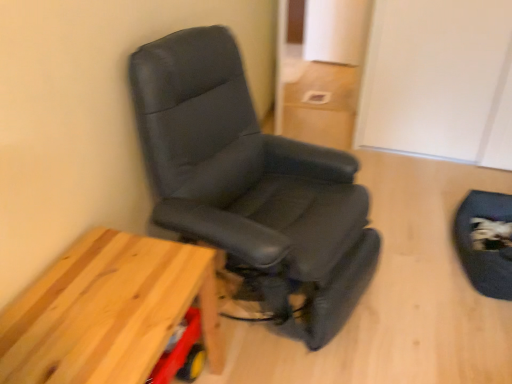
Question: Is black leather swivel chair at lower right surrounding wooden table at lower left?

Choices:
 (A) no
 (B) yes

Answer: (A)

Question: From the image's perspective, is black leather swivel chair at lower right under wooden table at lower left?

Choices:
 (A) yes
 (B) no

Answer: (B)

Question: Can you confirm if black leather swivel chair at lower right is positioned to the right of wooden table at lower left?

Choices:
 (A) yes
 (B) no

Answer: (A)

Question: Are black leather swivel chair at lower right and wooden table at lower left far apart?

Choices:
 (A) no
 (B) yes

Answer: (B)

Question: Considering the relative sizes of black leather swivel chair at lower right and wooden table at lower left in the image provided, is black leather swivel chair at lower right bigger than wooden table at lower left?

Choices:
 (A) no
 (B) yes

Answer: (A)

Question: From a real-world perspective, is black leather swivel chair at lower right physically below wooden table at lower left?

Choices:
 (A) no
 (B) yes

Answer: (B)

Question: Does wooden table at lower left touch black leather swivel chair at lower right?

Choices:
 (A) no
 (B) yes

Answer: (A)

Question: Can black leather swivel chair at lower right be found inside wooden table at lower left?

Choices:
 (A) yes
 (B) no

Answer: (B)

Question: From a real-world perspective, does wooden table at lower left sit lower than black leather swivel chair at lower right?

Choices:
 (A) yes
 (B) no

Answer: (B)

Question: From a real-world perspective, is wooden table at lower left positioned over black leather swivel chair at lower right based on gravity?

Choices:
 (A) no
 (B) yes

Answer: (B)

Question: Could you tell me if wooden table at lower left is facing black leather swivel chair at lower right?

Choices:
 (A) yes
 (B) no

Answer: (B)

Question: Is wooden table at lower left further to the viewer compared to black leather swivel chair at lower right?

Choices:
 (A) yes
 (B) no

Answer: (B)

Question: Is black leather chair at left located within black leather swivel chair at lower right?

Choices:
 (A) yes
 (B) no

Answer: (B)